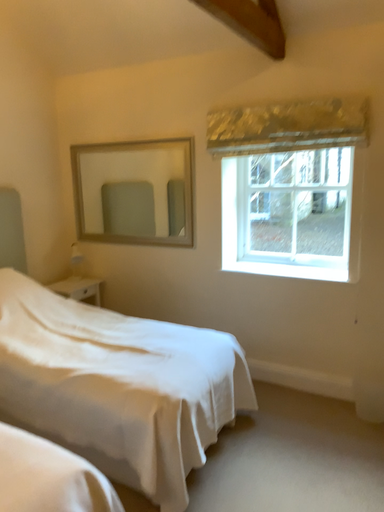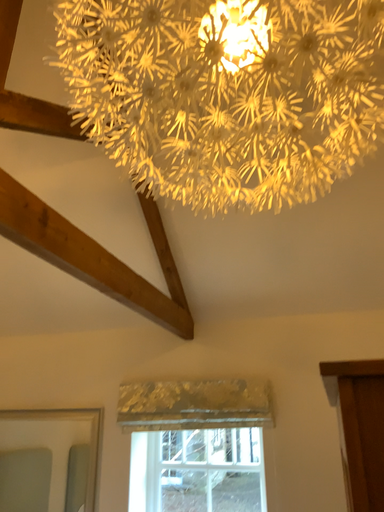
Question: Which way did the camera rotate in the video?

Choices:
 (A) rotated downward
 (B) rotated upward

Answer: (B)